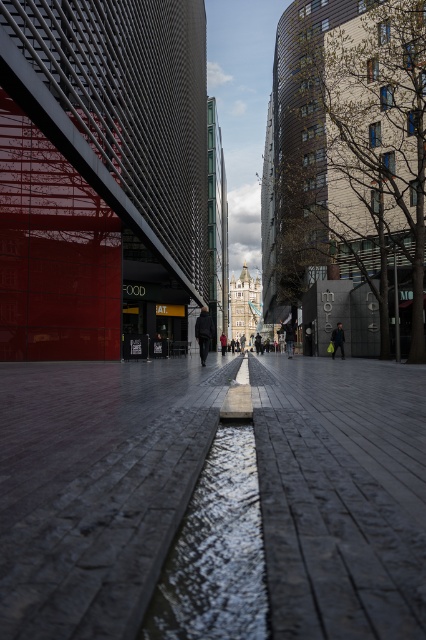
You are standing on the dark gray stone pavement at center and want to step onto the reflective concrete puddle at center. Is the puddle above or below your current position?

The dark gray stone pavement at center is located below the reflective concrete puddle at center, so the puddle is above your current position.